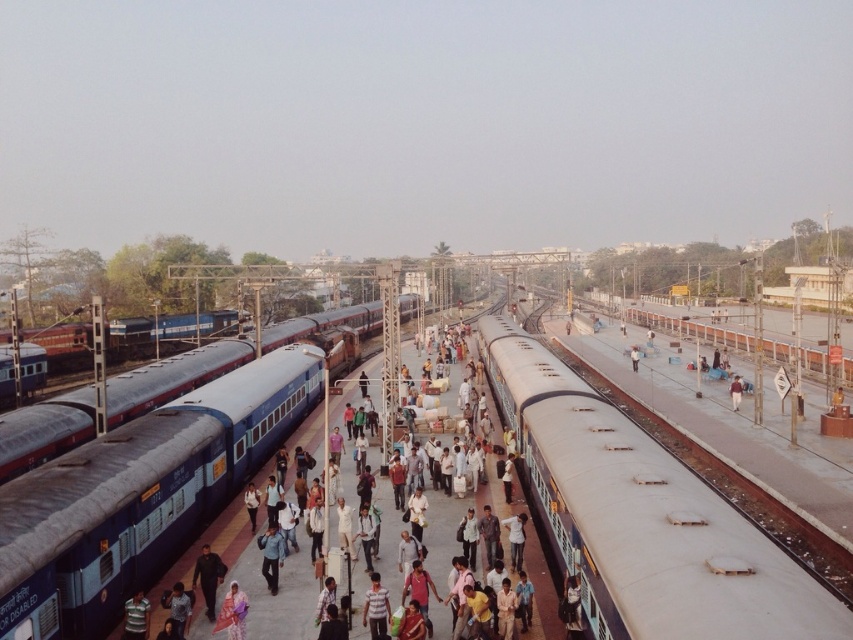
Question: Can you confirm if metallic silver helmet at center is positioned below brown fabric bag at center?

Choices:
 (A) no
 (B) yes

Answer: (B)

Question: Estimate the real-world distances between objects in this image. Which object is farther from the brown fabric bag at center?

Choices:
 (A) metallic silver helmet at center
 (B) blue metallic train at center
 (C) blue fabric shirt at center

Answer: (B)

Question: Does blue metallic train at center appear on the left side of brown fabric bag at center?

Choices:
 (A) yes
 (B) no

Answer: (A)

Question: Among these points, which one is farthest from the camera?

Choices:
 (A) (730, 394)
 (B) (271, 566)
 (C) (138, 595)

Answer: (A)

Question: Is the position of silver metallic train at center less distant than that of blue metallic train at center?

Choices:
 (A) no
 (B) yes

Answer: (B)

Question: Which point is closer to the camera taking this photo?

Choices:
 (A) [x=215, y=364]
 (B) [x=281, y=556]
 (C) [x=730, y=401]

Answer: (B)